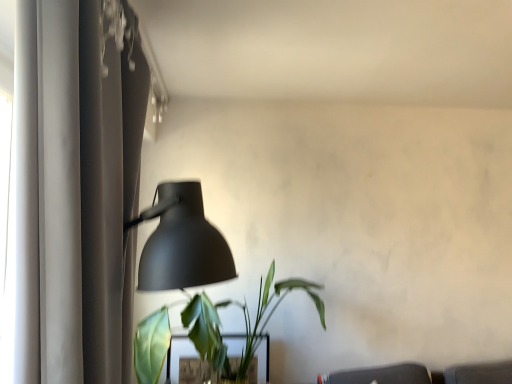
Question: From a real-world perspective, relative to matte black lamp at left, is matte gray curtain at left vertically above or below?

Choices:
 (A) above
 (B) below

Answer: (A)

Question: In terms of size, does matte gray curtain at left appear bigger or smaller than matte black lamp at left?

Choices:
 (A) big
 (B) small

Answer: (A)

Question: Estimate the real-world distances between objects in this image. Which object is farther from the matte gray curtain at left?

Choices:
 (A) green matte plant at lower center
 (B) green matte plant at lower center
 (C) matte black lamp at left

Answer: (B)

Question: Considering the real-world distances, which object is farthest from the matte gray curtain at left?

Choices:
 (A) green matte plant at lower center
 (B) matte black lamp at left
 (C) green matte plant at lower center

Answer: (A)